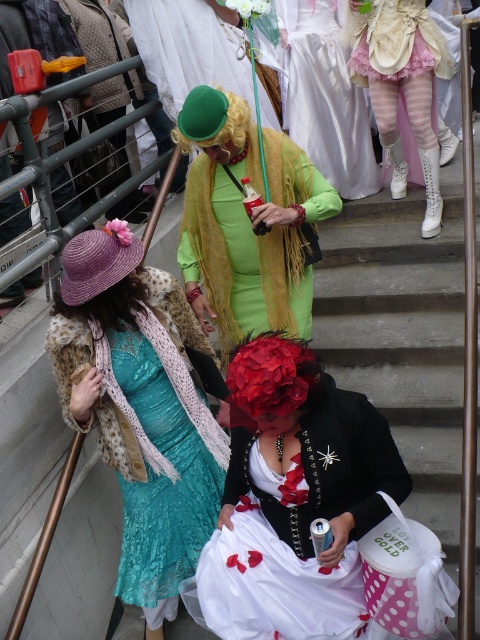
Question: Which of the following is the closest to the observer?

Choices:
 (A) white striped tights at center
 (B) purple straw wig at lower left

Answer: (B)

Question: Does white satin dress at upper center appear under white striped tights at center?

Choices:
 (A) yes
 (B) no

Answer: (B)

Question: Can you confirm if white striped tights at center is smaller than green felt hat at center?

Choices:
 (A) no
 (B) yes

Answer: (A)

Question: Is teal lace dress at center below purple straw wig at lower left?

Choices:
 (A) yes
 (B) no

Answer: (A)

Question: Which of the following is the closest to the observer?

Choices:
 (A) (304, 276)
 (B) (319, 561)
 (C) (132, 307)

Answer: (B)

Question: Which of the following is the closest to the observer?

Choices:
 (A) green felt hat at center
 (B) green matte dress at center

Answer: (B)